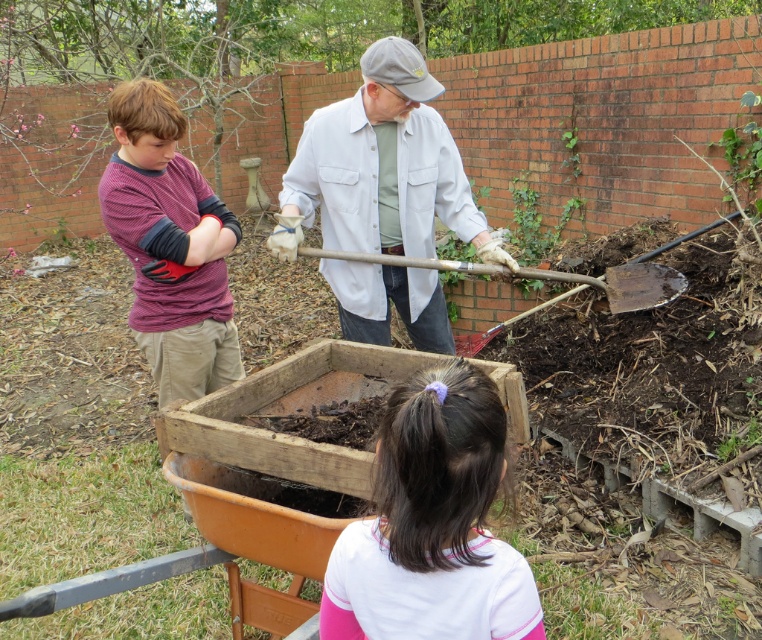
Can you confirm if striped cotton shirt at left is smaller than green leafy plant at upper right?

No.

This screenshot has width=762, height=640. What do you see at coordinates (170, 244) in the screenshot?
I see `striped cotton shirt at left` at bounding box center [170, 244].

Who is more distant from viewer, [175,172] or [744,157]?

The point [744,157] is behind.

Where is `striped cotton shirt at left`? striped cotton shirt at left is located at coordinates (170, 244).

Is point (315, 138) closer to viewer compared to point (155, 308)?

Yes, point (315, 138) is closer to viewer.

Can you confirm if white matte shirt at center is positioned to the right of striped cotton shirt at left?

Yes, white matte shirt at center is to the right of striped cotton shirt at left.

This screenshot has width=762, height=640. Find the location of `white matte shirt at center`. white matte shirt at center is located at coordinates (381, 168).

Is pink fabric ponytail at lower center below striped cotton shirt at left?

Indeed, pink fabric ponytail at lower center is positioned under striped cotton shirt at left.

Does pink fabric ponytail at lower center have a greater width compared to striped cotton shirt at left?

No.

Does point (379, 536) lie behind point (146, 289)?

No, (379, 536) is closer to viewer.

At what (x,y) coordinates should I click in order to perform the action: click on pink fabric ponytail at lower center. Please return your answer as a coordinate pair (x, y). The width and height of the screenshot is (762, 640). Looking at the image, I should click on (431, 524).